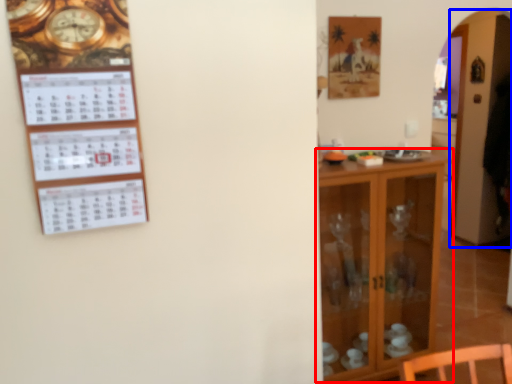
Question: Which object is closer to the camera taking this photo, shelf (highlighted by a red box) or glass door (highlighted by a blue box)?

Choices:
 (A) shelf
 (B) glass door

Answer: (A)